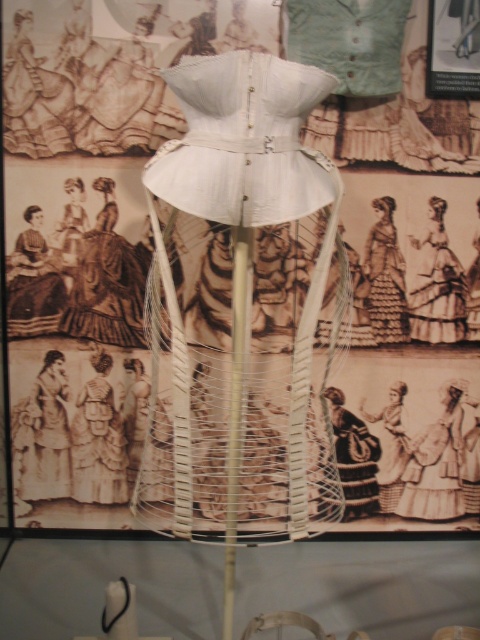
Does matte white dress at center appear over light beige fabric dress at lower left?

Correct, matte white dress at center is located above light beige fabric dress at lower left.

Which is in front, point (418, 282) or point (48, 387)?

Point (418, 282)

Measure the distance between point (x=410, y=308) and camera.

Point (x=410, y=308) is 2.46 meters away from camera.

Where is `matte white dress at center`? matte white dress at center is located at coordinates coord(436,284).

Does point (407, 508) come farther from viewer compared to point (62, 472)?

That is True.

Does point (453, 387) lie behind point (40, 419)?

Yes, it is.

Find the location of a particular element. brown textured dress at center is located at coordinates (441, 461).

Between matte white dress at center and dark brown fabric dress at center, which one appears on the left side from the viewer's perspective?

dark brown fabric dress at center is more to the left.

Which is below, matte white dress at center or dark brown fabric dress at center?

dark brown fabric dress at center is below.

Does point (422, 321) come closer to viewer compared to point (24, 300)?

No.

Locate an element on the screen. Image resolution: width=480 pixels, height=640 pixels. matte white dress at center is located at coordinates (436, 284).